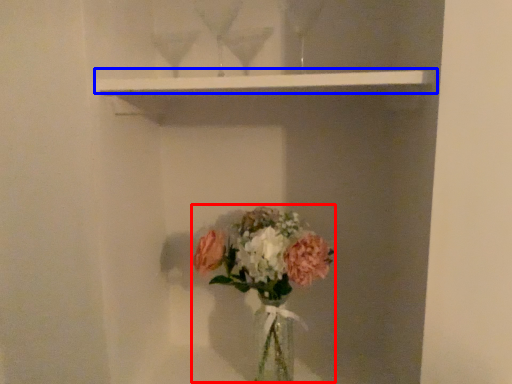
Question: Among these objects, which one is nearest to the camera, floral arrangement (highlighted by a red box) or window sill (highlighted by a blue box)?

Choices:
 (A) floral arrangement
 (B) window sill

Answer: (B)